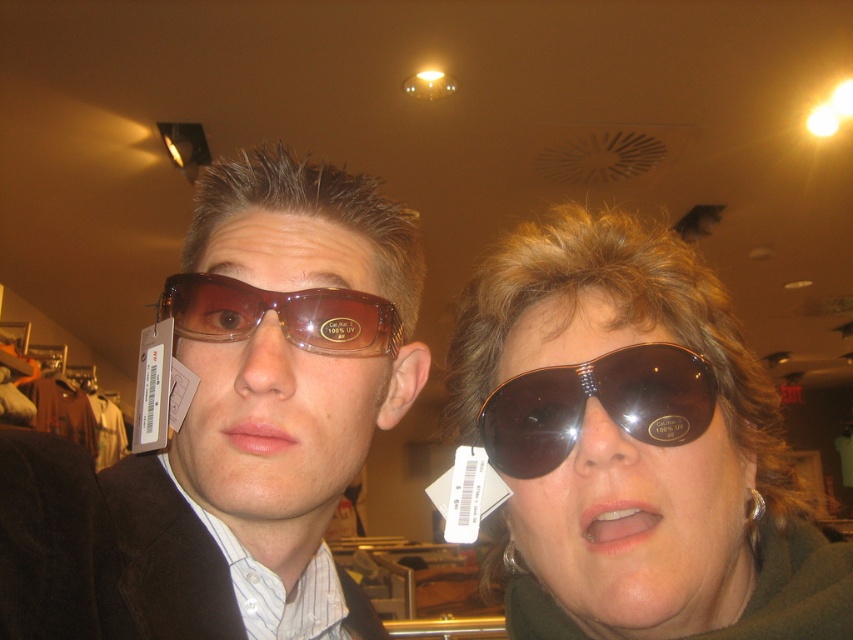
Can you confirm if matte brown sunglasses at left is taller than brown matte sunglasses at center?

Yes, matte brown sunglasses at left is taller than brown matte sunglasses at center.

Does matte brown sunglasses at left appear under brown matte sunglasses at center?

No, matte brown sunglasses at left is not below brown matte sunglasses at center.

Which is behind, point (286, 419) or point (599, 612)?

Point (599, 612)

This screenshot has height=640, width=853. I want to click on matte brown sunglasses at left, so click(x=231, y=422).

Does brown matte sunglasses at center have a lesser width compared to brown matte sunglasses at left?

No, brown matte sunglasses at center is not thinner than brown matte sunglasses at left.

Consider the image. Can you confirm if brown matte sunglasses at center is positioned above brown matte sunglasses at left?

Actually, brown matte sunglasses at center is below brown matte sunglasses at left.

Is point (651, 413) positioned in front of point (367, 307)?

Yes, point (651, 413) is in front of point (367, 307).

At what (x,y) coordinates should I click in order to perform the action: click on brown matte sunglasses at center. Please return your answer as a coordinate pair (x, y). This screenshot has height=640, width=853. Looking at the image, I should click on (635, 445).

Can you confirm if brown shiny aviator sunglasses at center is bigger than brown matte sunglasses at left?

Incorrect, brown shiny aviator sunglasses at center is not larger than brown matte sunglasses at left.

This screenshot has height=640, width=853. What do you see at coordinates (599, 403) in the screenshot?
I see `brown shiny aviator sunglasses at center` at bounding box center [599, 403].

At what (x,y) coordinates should I click in order to perform the action: click on brown shiny aviator sunglasses at center. Please return your answer as a coordinate pair (x, y). This screenshot has height=640, width=853. Looking at the image, I should click on (599, 403).

Locate an element on the screen. brown shiny aviator sunglasses at center is located at coordinates (599, 403).